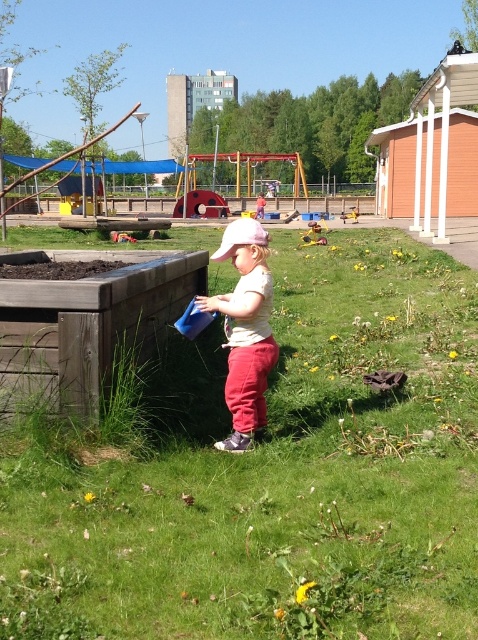
You are a parent trying to locate your child in the park. You see the green grass at center and the matte white shirt at center. Which object is closer to the front of the image?

The green grass at center is closer to the front of the image because it is taller than the matte white shirt at center, indicating it is in front.

You are standing in the park and want to place a small garden gnome exactly where the green grass at center is located. What are the coordinates where you should place it?

The coordinates for the green grass at center are point (271,476), so you should place the garden gnome there.

You are a parent trying to locate your child who is wearing a white shirt in a park. You see the green grass at center and the matte white shirt at center. Which object is positioned to the right of the other?

The green grass at center is to the right of the matte white shirt at center.